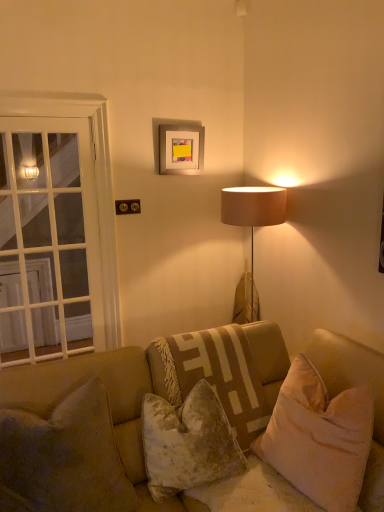
Image resolution: width=384 pixels, height=512 pixels. What do you see at coordinates (319, 438) in the screenshot?
I see `velvet beige pillow at lower right, positioned as the fourth pillow in left-to-right order` at bounding box center [319, 438].

Measure the distance between point (213, 498) and camera.

Point (213, 498) is 5.51 feet away from camera.

The width and height of the screenshot is (384, 512). I want to click on velvet beige pillow at center, which appears as the 2th pillow when viewed from the left, so click(188, 442).

You are a GUI agent. You are given a task and a screenshot of the screen. Output one action in this format:
    pyautogui.click(x=<x>, y=<y>)
    Task: Click on the velvety beige pillow at lower left, which is the fourth pillow from right to left
    Image resolution: width=384 pixels, height=512 pixels.
    Given the screenshot: What is the action you would take?
    pyautogui.click(x=64, y=458)

In order to face white glass door at left, should I rotate leftwards or rightwards?

Rotate left and turn 19.138 degrees.

This screenshot has width=384, height=512. What are the coordinates of `velvet beige pillow at center, marked as the third pillow in a left-to-right arrangement` in the screenshot? It's located at (213, 375).

From the image's perspective, is white glass door at left located above velvety beige pillow at lower left, the 1th pillow viewed from the left?

Yes, from the image's perspective, white glass door at left is above velvety beige pillow at lower left, the 1th pillow viewed from the left.

Between white glass door at left and velvety beige pillow at lower left, the 1th pillow viewed from the left, which one has more height?

With more height is white glass door at left.

From a real-world perspective, between velvet beige pillow at center, marked as the third pillow in a left-to-right arrangement, and silver metallic picture frame at upper center, who is vertically higher?

From a 3D spatial view, silver metallic picture frame at upper center is above.

Looking at this image, from the image's perspective, is velvet beige pillow at center, marked as the third pillow in a left-to-right arrangement, located beneath silver metallic picture frame at upper center?

Yes.

How many degrees apart are the facing directions of velvet beige pillow at center, which is the second pillow in right-to-left order, and silver metallic picture frame at upper center?

The angle between the facing direction of velvet beige pillow at center, which is the second pillow in right-to-left order, and the facing direction of silver metallic picture frame at upper center is 6.16 degrees.

Is velvet beige pillow at center, which is the second pillow in right-to-left order, outside of silver metallic picture frame at upper center?

Absolutely, velvet beige pillow at center, which is the second pillow in right-to-left order, is external to silver metallic picture frame at upper center.

From a real-world perspective, who is located lower, silver metallic picture frame at upper center or velvet beige pillow at center, which is the second pillow in right-to-left order?

velvet beige pillow at center, which is the second pillow in right-to-left order, is physically lower.

Considering the relative positions of silver metallic picture frame at upper center and velvet beige pillow at center, marked as the third pillow in a left-to-right arrangement, in the image provided, is silver metallic picture frame at upper center to the left or to the right of velvet beige pillow at center, marked as the third pillow in a left-to-right arrangement,?

In the image, silver metallic picture frame at upper center appears on the left side of velvet beige pillow at center, marked as the third pillow in a left-to-right arrangement.

Choose the correct answer: Is silver metallic picture frame at upper center inside velvet beige pillow at center, marked as the third pillow in a left-to-right arrangement, or outside it?

silver metallic picture frame at upper center is located beyond the bounds of velvet beige pillow at center, marked as the third pillow in a left-to-right arrangement.

Does silver metallic picture frame at upper center turn towards velvet beige pillow at center, which is the second pillow in right-to-left order?

A: No.

Looking at this image, from their relative heights in the image, would you say velvet beige pillow at lower right, positioned as the fourth pillow in left-to-right order, is taller or shorter than velvety beige pillow at lower left, which is the fourth pillow from right to left?

Clearly, velvet beige pillow at lower right, positioned as the fourth pillow in left-to-right order, is taller compared to velvety beige pillow at lower left, which is the fourth pillow from right to left.

From a real-world perspective, which is physically above, velvet beige pillow at lower right, positioned as the fourth pillow in left-to-right order, or velvety beige pillow at lower left, the 1th pillow viewed from the left?

From a 3D spatial view, velvet beige pillow at lower right, positioned as the fourth pillow in left-to-right order, is above.

Choose the correct answer: Is velvet beige pillow at lower right, positioned as the fourth pillow in left-to-right order, inside velvety beige pillow at lower left, which is the fourth pillow from right to left, or outside it?

The correct answer is: outside.

From the image's perspective, between velvet beige pillow at lower right, the first pillow in the right-to-left sequence, and white glass door at left, which one is located above?

white glass door at left appears higher in the image.

Considering their positions, is velvet beige pillow at lower right, positioned as the fourth pillow in left-to-right order, located in front of or behind white glass door at left?

velvet beige pillow at lower right, positioned as the fourth pillow in left-to-right order, is positioned closer to the viewer than white glass door at left.

Can you confirm if velvet beige pillow at lower right, positioned as the fourth pillow in left-to-right order, is taller than white glass door at left?

In fact, velvet beige pillow at lower right, positioned as the fourth pillow in left-to-right order, may be shorter than white glass door at left.

How different are the orientations of velvet beige pillow at lower right, the first pillow in the right-to-left sequence, and white glass door at left in degrees?

The angle between the facing direction of velvet beige pillow at lower right, the first pillow in the right-to-left sequence, and the facing direction of white glass door at left is 82.9 degrees.

Is velvety beige pillow at lower left, the 1th pillow viewed from the left, surrounded by velvet beige pillow at center, marked as the third pillow in a left-to-right arrangement?

No, velvety beige pillow at lower left, the 1th pillow viewed from the left, is not a part of velvet beige pillow at center, marked as the third pillow in a left-to-right arrangement.

Does velvet beige pillow at center, marked as the third pillow in a left-to-right arrangement, have a lesser height compared to velvety beige pillow at lower left, the 1th pillow viewed from the left?

No, velvet beige pillow at center, marked as the third pillow in a left-to-right arrangement, is not shorter than velvety beige pillow at lower left, the 1th pillow viewed from the left.

At what (x,y) coordinates should I click in order to perform the action: click on pillow that is the 2nd object to the right of the velvety beige pillow at lower left, which is the fourth pillow from right to left, starting at the anchor. Please return your answer as a coordinate pair (x, y). This screenshot has height=512, width=384. Looking at the image, I should click on (213, 375).

In the scene shown: Which object is positioned more to the right, velvet beige pillow at center, marked as the third pillow in a left-to-right arrangement, or velvety beige pillow at lower left, which is the fourth pillow from right to left?

velvet beige pillow at center, marked as the third pillow in a left-to-right arrangement, is more to the right.

Can you confirm if velvety beige pillow at lower left, the 1th pillow viewed from the left, is shorter than velvet beige pillow at lower right, the first pillow in the right-to-left sequence?

Indeed, velvety beige pillow at lower left, the 1th pillow viewed from the left, has a lesser height compared to velvet beige pillow at lower right, the first pillow in the right-to-left sequence.

Is velvety beige pillow at lower left, the 1th pillow viewed from the left, facing away from velvet beige pillow at lower right, the first pillow in the right-to-left sequence?

No, velvet beige pillow at lower right, the first pillow in the right-to-left sequence, is not at the back of velvety beige pillow at lower left, the 1th pillow viewed from the left.

Is velvety beige pillow at lower left, which is the fourth pillow from right to left, positioned beyond the bounds of velvet beige pillow at lower right, the first pillow in the right-to-left sequence?

velvety beige pillow at lower left, which is the fourth pillow from right to left, is positioned outside velvet beige pillow at lower right, the first pillow in the right-to-left sequence.

Considering the relative positions of velvety beige pillow at lower left, the 1th pillow viewed from the left, and velvet beige pillow at lower right, the first pillow in the right-to-left sequence, in the image provided, is velvety beige pillow at lower left, the 1th pillow viewed from the left, to the right of velvet beige pillow at lower right, the first pillow in the right-to-left sequence, from the viewer's perspective?

No.

The height and width of the screenshot is (512, 384). Find the location of `glass door above the velvety beige pillow at lower left, which is the fourth pillow from right to left (from the image's perspective)`. glass door above the velvety beige pillow at lower left, which is the fourth pillow from right to left (from the image's perspective) is located at coordinates (49, 239).

I want to click on the 1st pillow in front of the silver metallic picture frame at upper center, counting from the anchor's position, so click(213, 375).

From the image, which object appears to be nearer to velvet beige pillow at center, marked as the third pillow in a left-to-right arrangement, silver metallic picture frame at upper center or velvet beige pillow at lower right, the first pillow in the right-to-left sequence?

Based on the image, velvet beige pillow at lower right, the first pillow in the right-to-left sequence, appears to be nearer to velvet beige pillow at center, marked as the third pillow in a left-to-right arrangement.

Which object lies nearer to the anchor point velvet beige pillow at lower right, positioned as the fourth pillow in left-to-right order, velvety beige pillow at lower left, which is the fourth pillow from right to left, or velvet beige pillow at center, which is the third pillow in right-to-left order?

velvet beige pillow at center, which is the third pillow in right-to-left order.

From the image, which object appears to be farther from velvet beige couch at center, velvet beige pillow at center, marked as the third pillow in a left-to-right arrangement, or velvet beige pillow at lower right, positioned as the fourth pillow in left-to-right order?

velvet beige pillow at lower right, positioned as the fourth pillow in left-to-right order.

Looking at the image, which one is located further to silver metallic picture frame at upper center, velvet beige pillow at center, which is the second pillow in right-to-left order, or velvet beige pillow at lower right, the first pillow in the right-to-left sequence?

velvet beige pillow at lower right, the first pillow in the right-to-left sequence, is positioned further to the anchor silver metallic picture frame at upper center.

Looking at the image, which one is located further to velvet beige pillow at lower right, positioned as the fourth pillow in left-to-right order, silver metallic picture frame at upper center or velvety beige pillow at lower left, the 1th pillow viewed from the left?

silver metallic picture frame at upper center lies further to velvet beige pillow at lower right, positioned as the fourth pillow in left-to-right order, than the other object.

Which object lies further to the anchor point velvet beige pillow at center, which is the second pillow in right-to-left order, velvet beige pillow at lower right, the first pillow in the right-to-left sequence, or silver metallic picture frame at upper center?

silver metallic picture frame at upper center.

When comparing their distances from silver metallic picture frame at upper center, does velvety beige pillow at lower left, which is the fourth pillow from right to left, or white glass door at left seem closer?

Among the two, white glass door at left is located nearer to silver metallic picture frame at upper center.

From the image, which object appears to be nearer to velvet beige pillow at lower right, the first pillow in the right-to-left sequence, silver metallic picture frame at upper center or velvet beige pillow at center, which is the third pillow in right-to-left order?

velvet beige pillow at center, which is the third pillow in right-to-left order, is positioned closer to the anchor velvet beige pillow at lower right, the first pillow in the right-to-left sequence.

At what (x,y) coordinates should I click in order to perform the action: click on glass door located between velvety beige pillow at lower left, the 1th pillow viewed from the left, and silver metallic picture frame at upper center in the depth direction. Please return your answer as a coordinate pair (x, y). Looking at the image, I should click on (49, 239).

Locate an element on the screen. This screenshot has height=512, width=384. studio couch between velvety beige pillow at lower left, the 1th pillow viewed from the left, and velvet beige pillow at lower right, positioned as the fourth pillow in left-to-right order, from left to right is located at coordinates (139, 425).

Locate an element on the screen. pillow between velvety beige pillow at lower left, which is the fourth pillow from right to left, and velvet beige pillow at center, which is the second pillow in right-to-left order is located at coordinates (188, 442).

What are the coordinates of `glass door that lies between silver metallic picture frame at upper center and velvet beige pillow at center, which is the third pillow in right-to-left order, from top to bottom` in the screenshot? It's located at (49, 239).